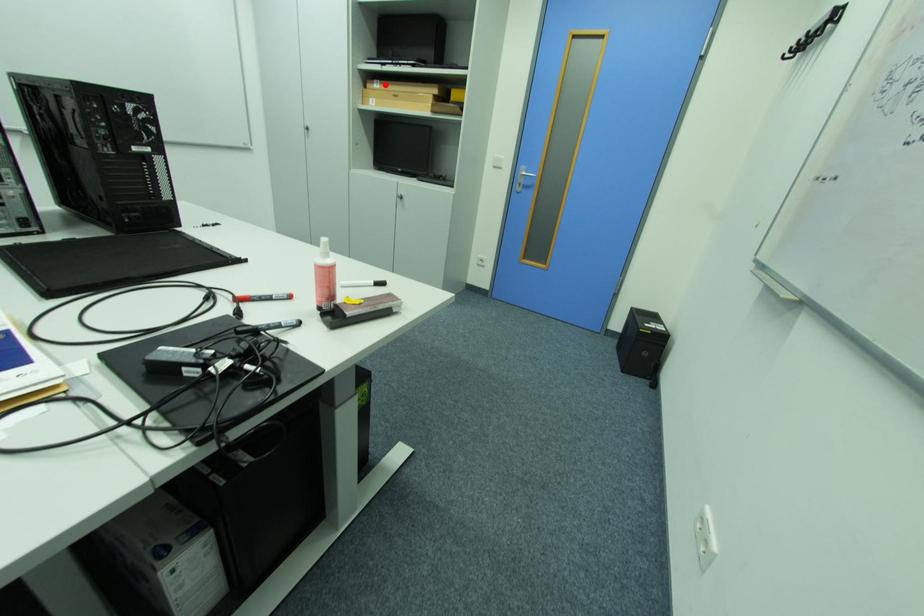
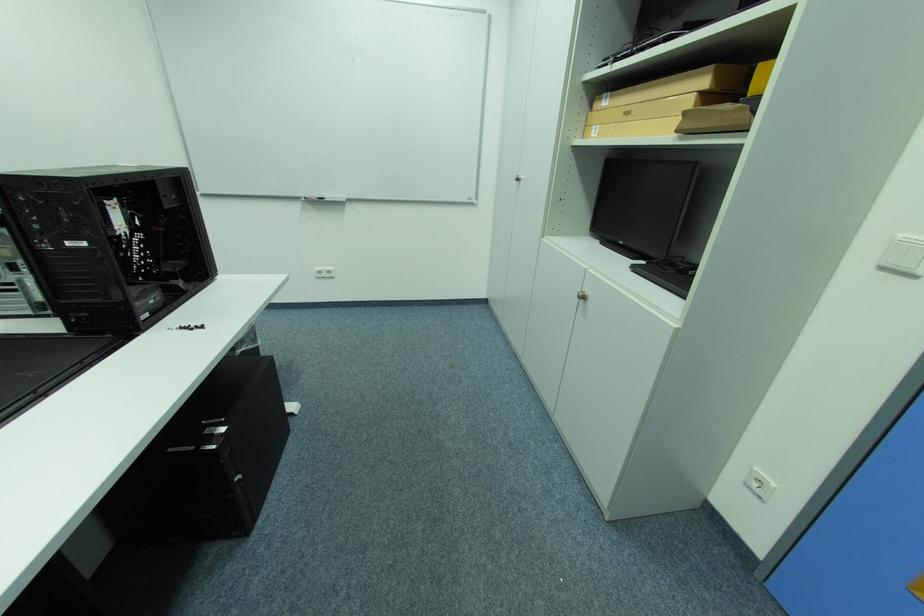
Where in the second image is the point corresponding to the highlighted location from the first image?

(614, 98)